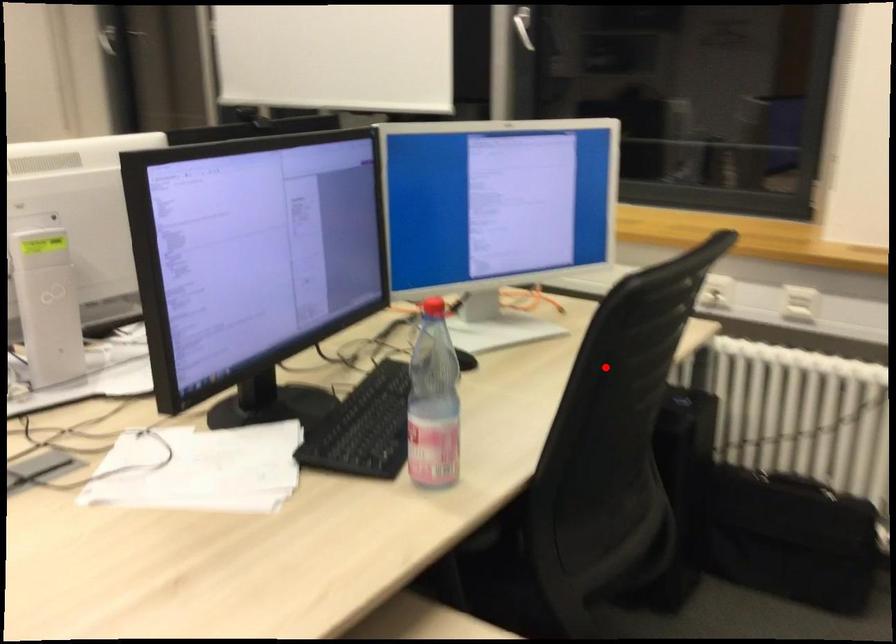
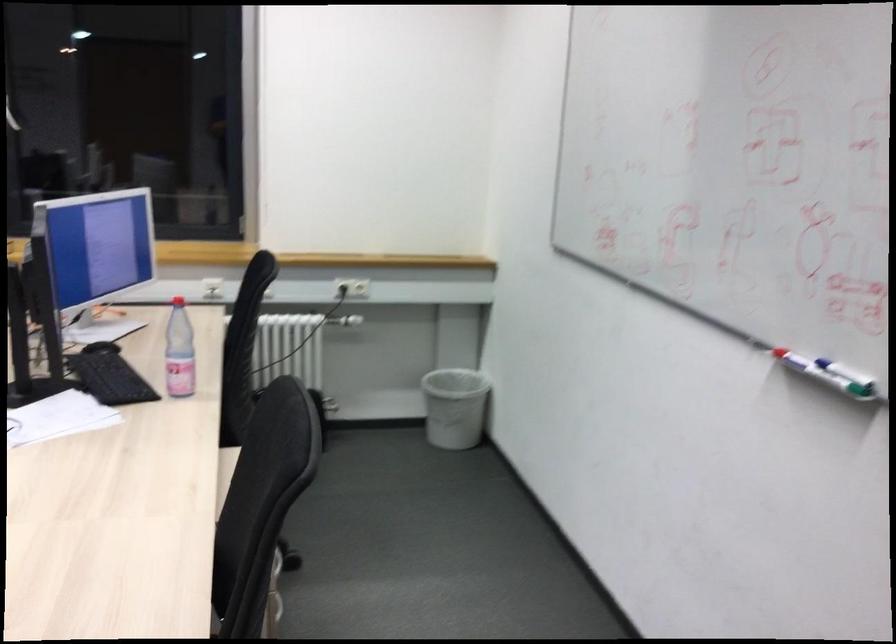
Question: I am providing you with two images of the same scene from different viewpoints. Given a red point in image1, look at the same physical point in image2. Is it:

Choices:
 (A) Closer to the viewpoint
 (B) Farther from the viewpoint

Answer: (B)